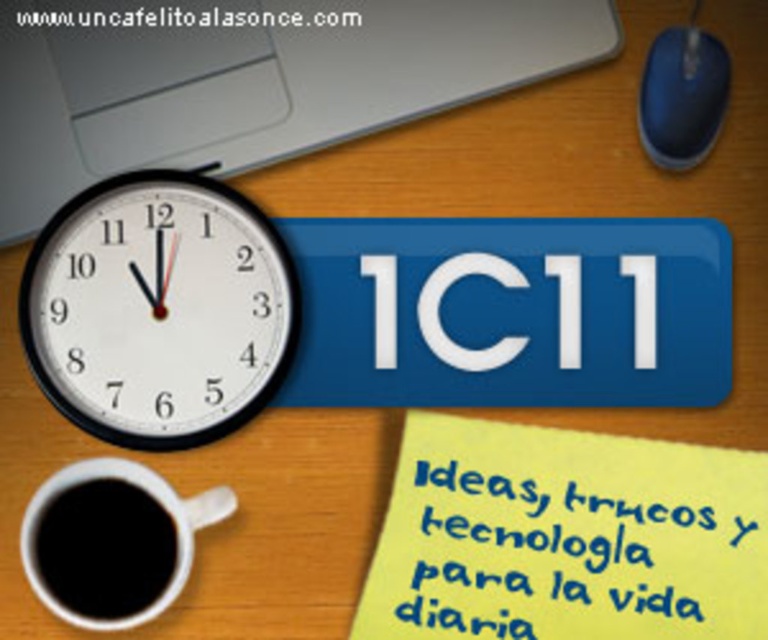
Question: Among these points, which one is nearest to the camera?

Choices:
 (A) (700, 80)
 (B) (157, 140)
 (C) (126, 525)
 (D) (500, 618)

Answer: (A)

Question: Can you confirm if white plastic clock at left is positioned above blue plastic mouse at upper right?

Choices:
 (A) no
 (B) yes

Answer: (A)

Question: Where is yellow paper at lower center located in relation to blue plastic mouse at upper right in the image?

Choices:
 (A) left
 (B) right

Answer: (A)

Question: Which of the following is the closest to the observer?

Choices:
 (A) (98, 419)
 (B) (151, 596)
 (C) (740, 547)
 (D) (239, 3)

Answer: (B)

Question: Does white plastic clock at left appear over blue plastic mouse at upper right?

Choices:
 (A) no
 (B) yes

Answer: (A)

Question: Which point is farther to the camera?

Choices:
 (A) silver metallic laptop at upper left
 (B) yellow paper at lower center
 (C) white plastic clock at left

Answer: (A)